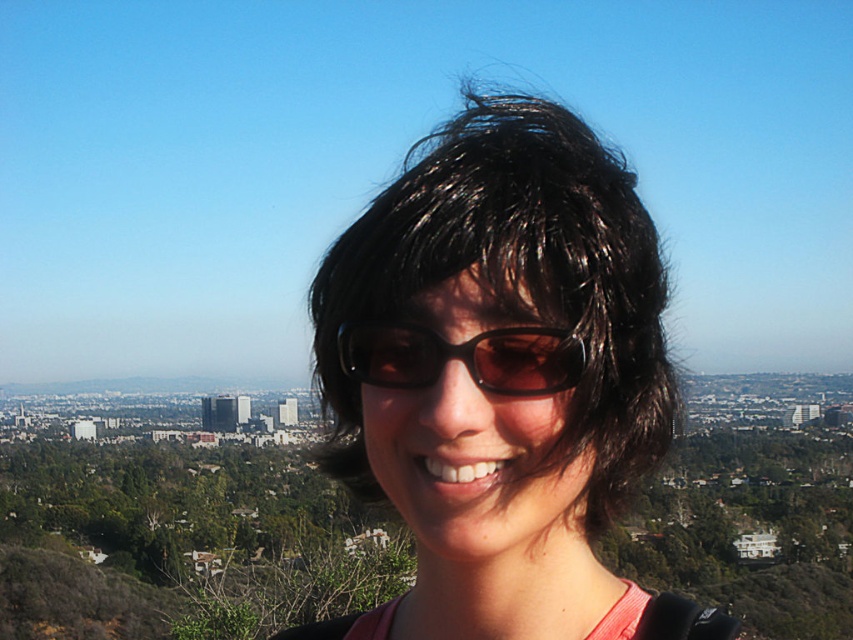
You are standing in the scene and want to place a small flag at each of the two points labeled point (610,300) and point (527,339). Which point is closer to you where you should place the flag first?

Point (610,300) is closer to the viewer than point (527,339), so you should place the flag there first.

You are a photographer trying to capture the perfect shot of the person in the scene. You notice the shiny black hair at center and the black matte sunglasses at center. Which object is positioned lower on the person?

The shiny black hair at center is located below black matte sunglasses at center, so the shiny black hair at center is positioned lower on the person.

From the picture: You are a photographer standing at the camera position. You want to take a closeup shot of the shiny black hair at center. Given that your camera has a maximum zoom range of 500 meters, can you capture the hair clearly?

The shiny black hair at center is 626.97 meters away from the camera. Since the camera can only zoom up to 500 meters, it cannot capture the hair clearly at this distance.